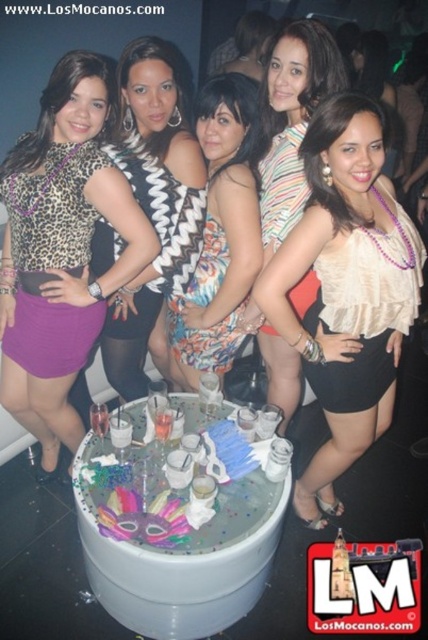
Question: Is leopard print top at center closer to the viewer compared to floral dress at center?

Choices:
 (A) no
 (B) yes

Answer: (B)

Question: Does white satin blouse at center appear on the right side of striped fabric dress at center?

Choices:
 (A) yes
 (B) no

Answer: (A)

Question: Is zigzag fabric dress at center wider than floral dress at center?

Choices:
 (A) no
 (B) yes

Answer: (B)

Question: Which point is farther from the camera taking this photo?

Choices:
 (A) (368, 99)
 (B) (36, 308)

Answer: (B)

Question: Based on their relative distances, which object is nearer to the zigzag fabric dress at center?

Choices:
 (A) white satin blouse at center
 (B) floral dress at center
 (C) striped fabric dress at center

Answer: (B)

Question: Which object is the farthest from the white satin blouse at center?

Choices:
 (A) leopard print top at center
 (B) floral dress at center
 (C) striped fabric dress at center
 (D) zigzag fabric dress at center

Answer: (A)